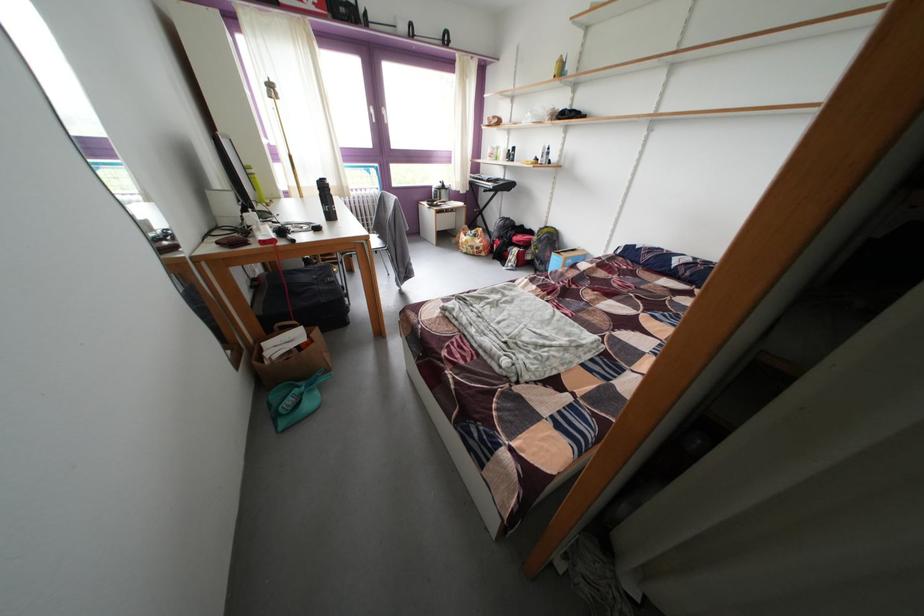
The image size is (924, 616). In order to click on white window handle in this screenshot , I will do `click(371, 113)`.